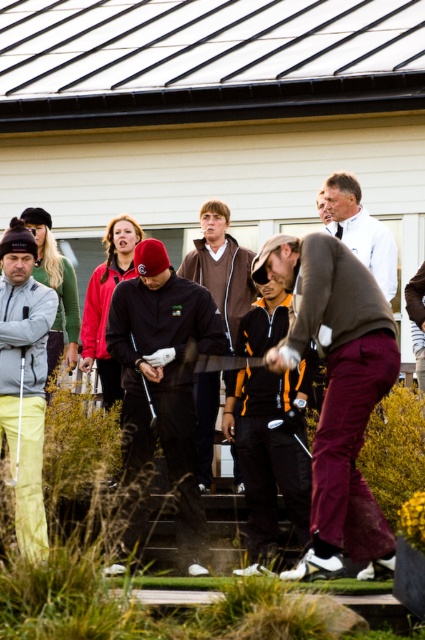
You are standing at the origin point in the image. Which direction should you move to reach the dark brown leather jacket at center?

The dark brown leather jacket at center is located at point 0.420 in the x and 0.816 in the y coordinates. Since you are at the origin, you would move towards the right and forward to reach it.

You are a photographer positioned behind the golfer in the dark jacket and maroon pants. You want to take a photo of the matte black golf club at center without the matte gray jacket at left blocking the view. Is this possible given their positions?

The matte gray jacket at left is in front of the matte black golf club at center, so it will block the view. Move to the right to capture the matte black golf club at center without obstruction.